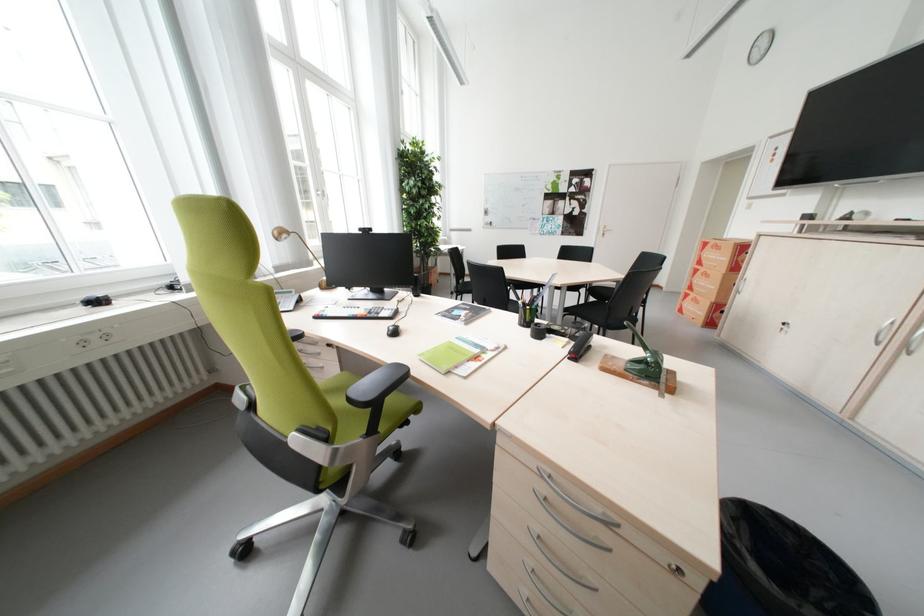
Locate an element on the screen. This screenshot has height=616, width=924. black pen holder is located at coordinates (528, 310).